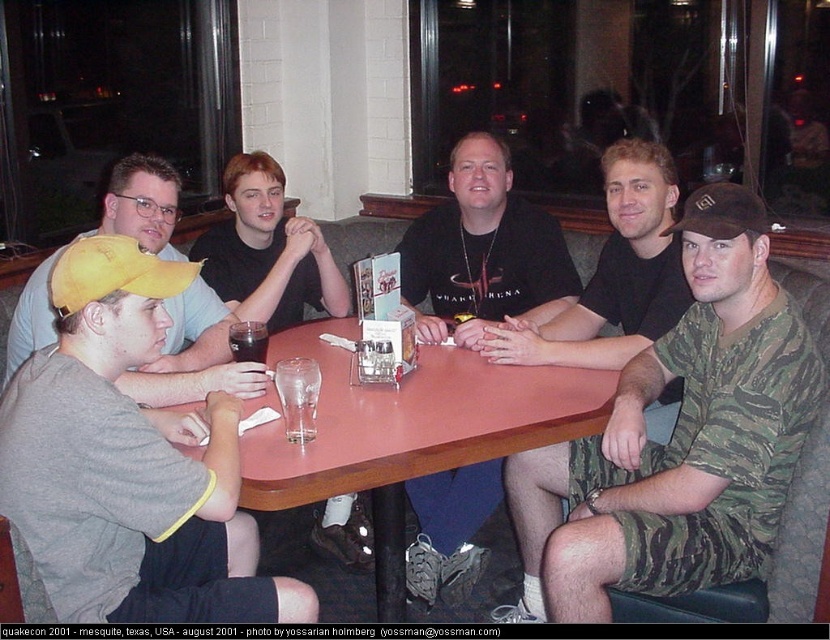
Question: Does camo fabric shirt at center have a larger size compared to brown fabric baseball cap at center?

Choices:
 (A) yes
 (B) no

Answer: (A)

Question: Which object appears closest to the camera in this image?

Choices:
 (A) pink laminate table at center
 (B) camo fabric shirt at center
 (C) yellow fabric cap at left
 (D) brown fabric baseball cap at center

Answer: (A)

Question: Considering the real-world distances, which object is farthest from the pink laminate table at center?

Choices:
 (A) gray cotton t-shirt at left
 (B) translucent glass cup at table center
 (C) yellow fabric cap at left
 (D) brown fabric baseball cap at center

Answer: (D)

Question: Which object is the farthest from the translucent glass cup at table center?

Choices:
 (A) brown fabric baseball cap at center
 (B) yellow fabric cap at left
 (C) camo fabric shirt at center

Answer: (A)

Question: Considering the relative positions of black shirt at center and yellow fabric baseball cap at left in the image provided, where is black shirt at center located with respect to yellow fabric baseball cap at left?

Choices:
 (A) left
 (B) right

Answer: (A)

Question: Considering the relative positions of black shirt at center and yellow fabric baseball cap at left in the image provided, where is black shirt at center located with respect to yellow fabric baseball cap at left?

Choices:
 (A) above
 (B) below

Answer: (A)